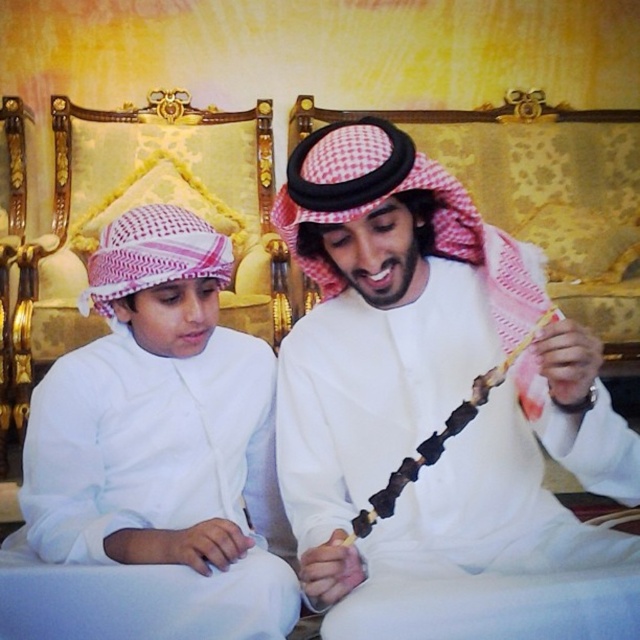
Is white matte kebab skewer at center to the left of white matte keffiyeh at center from the viewer's perspective?

No, white matte kebab skewer at center is not to the left of white matte keffiyeh at center.

Can you confirm if white matte kebab skewer at center is positioned below white matte keffiyeh at center?

No, white matte kebab skewer at center is not below white matte keffiyeh at center.

Locate an element on the screen. white matte kebab skewer at center is located at coordinates (438, 412).